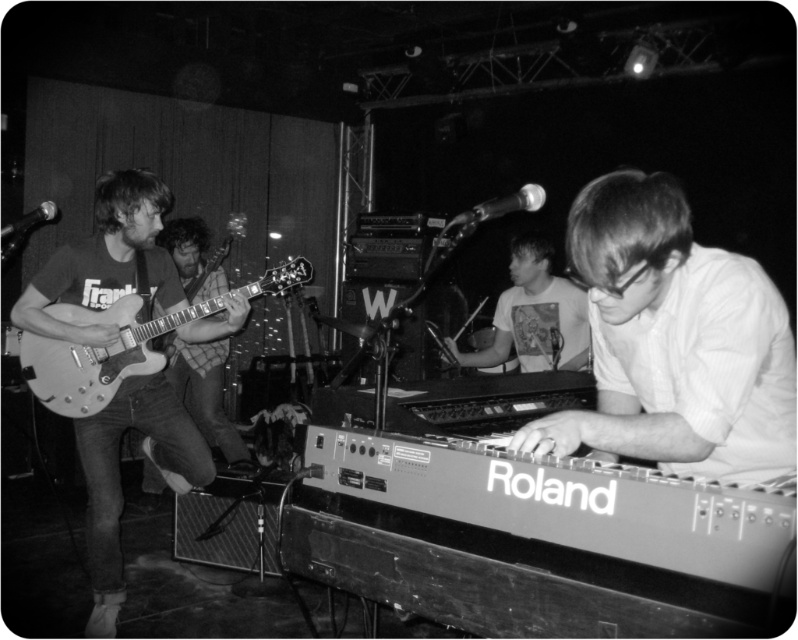
Which is above, matte wood guitar at left or metallic guitar at left?

matte wood guitar at left is above.

Consider the image. Measure the distance between point (x=141, y=253) and camera.

Point (x=141, y=253) and camera are 10.42 feet apart from each other.

Between point (93, 337) and point (192, 225), which one is positioned behind?

The point (192, 225) is behind.

Find the location of a particular element. The width and height of the screenshot is (798, 640). matte wood guitar at left is located at coordinates (105, 264).

The width and height of the screenshot is (798, 640). Find the location of `white matte keyboard at center`. white matte keyboard at center is located at coordinates (674, 340).

You are a GUI agent. You are given a task and a screenshot of the screen. Output one action in this format:
    pyautogui.click(x=<x>, y=<y>)
    Task: Click on the white matte keyboard at center
    
    Given the screenshot: What is the action you would take?
    pyautogui.click(x=674, y=340)

Does point (599, 179) come farther from viewer compared to point (109, 564)?

No, (599, 179) is closer to viewer.

Can you confirm if white matte keyboard at center is positioned to the left of matte wood guitar at left?

No, white matte keyboard at center is not to the left of matte wood guitar at left.

Is point (785, 371) closer to viewer compared to point (117, 524)?

Yes, it is.

The height and width of the screenshot is (640, 798). I want to click on white matte keyboard at center, so click(x=674, y=340).